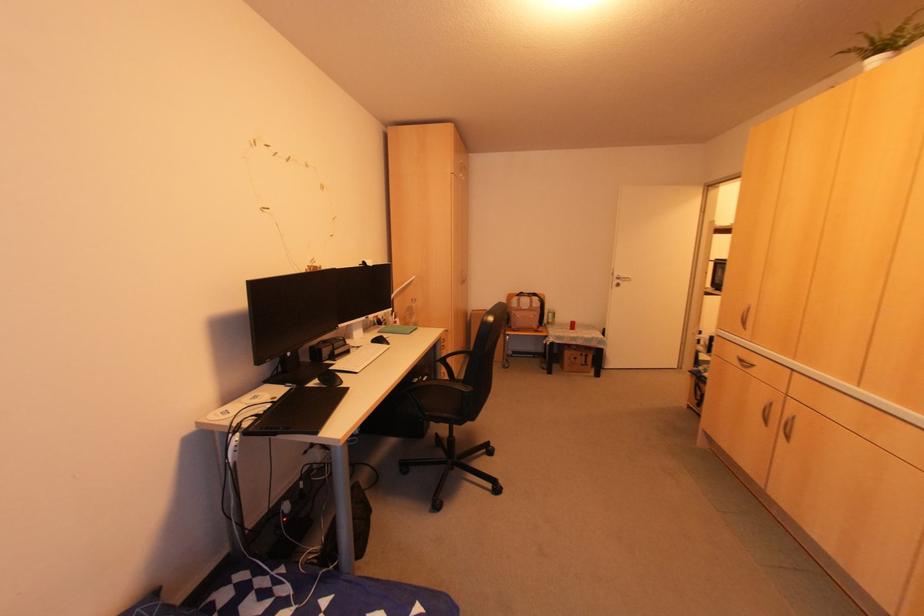
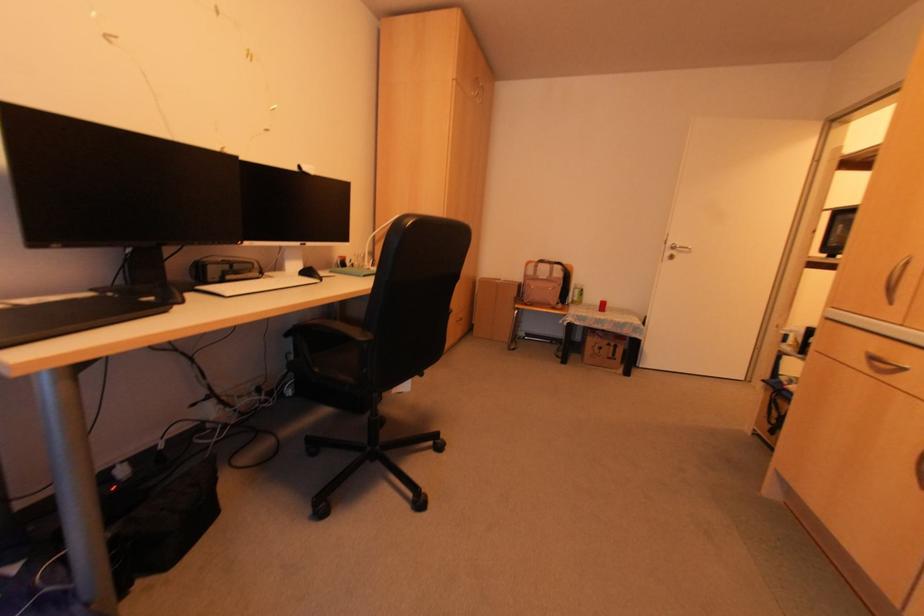
Locate, in the second image, the point that corresponds to (578,354) in the first image.

(604, 342)